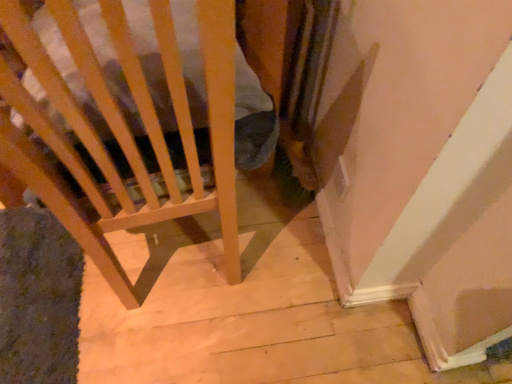
Find the location of a particular element. vacant region to the right of light brown wooden chair at center is located at coordinates (289, 262).